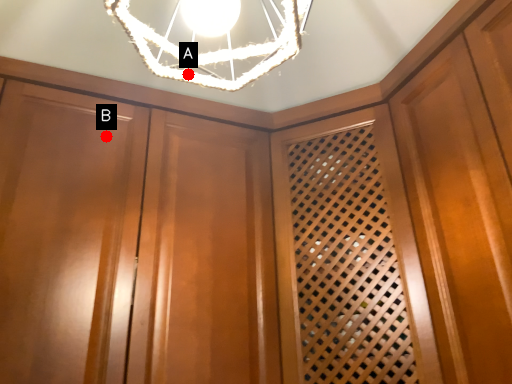
Question: Two points are circled on the image, labeled by A and B beside each circle. Which point is farther from the camera taking this photo?

Choices:
 (A) A is further
 (B) B is further

Answer: (B)